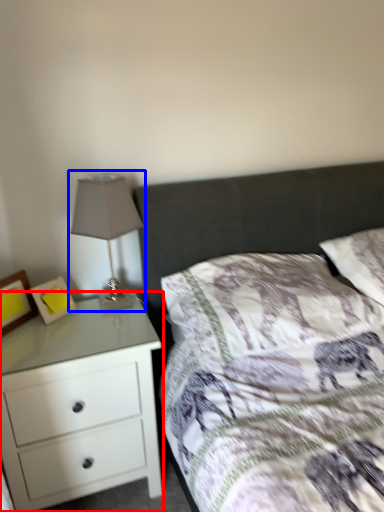
Question: Among these objects, which one is farthest to the camera, chest of drawers (highlighted by a red box) or table lamp (highlighted by a blue box)?

Choices:
 (A) chest of drawers
 (B) table lamp

Answer: (B)